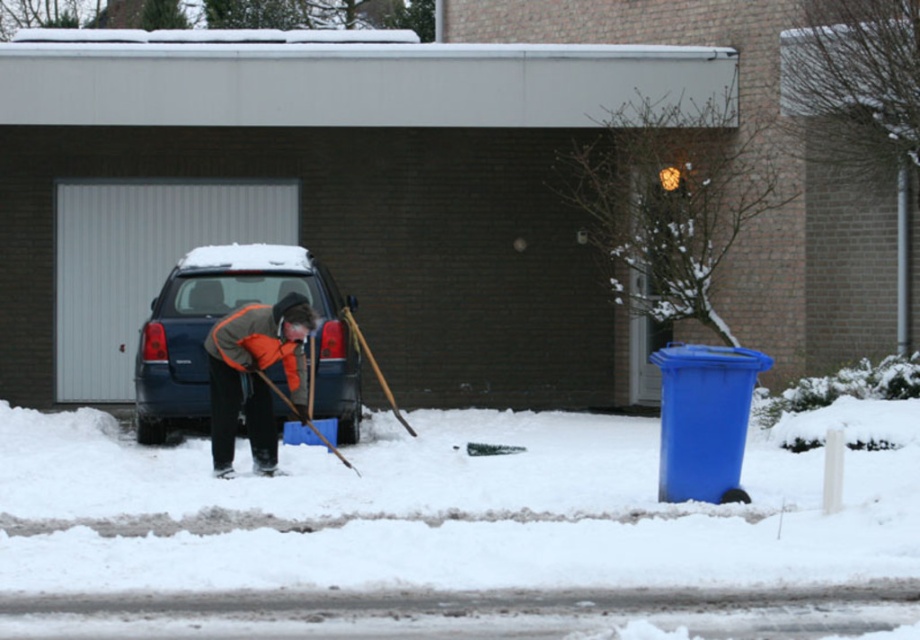
Question: Which point is closer to the camera taking this photo?

Choices:
 (A) (x=201, y=275)
 (B) (x=290, y=230)

Answer: (A)

Question: Considering the real-world distances, which object is farthest from the blue matte car at center?

Choices:
 (A) orange fleece jacket at center
 (B) wooden shovel at lower center
 (C) dark gray brick garage at center

Answer: (C)

Question: Can you confirm if blue matte car at center is positioned above wooden shovel at lower center?

Choices:
 (A) no
 (B) yes

Answer: (B)

Question: Does blue matte car at center lie behind wooden shovel at lower center?

Choices:
 (A) no
 (B) yes

Answer: (B)

Question: Considering the real-world distances, which object is closest to the blue matte car at center?

Choices:
 (A) dark gray brick garage at center
 (B) orange fleece jacket at center
 (C) wooden shovel at lower center

Answer: (C)

Question: Is blue matte car at center in front of orange fleece jacket at center?

Choices:
 (A) yes
 (B) no

Answer: (B)